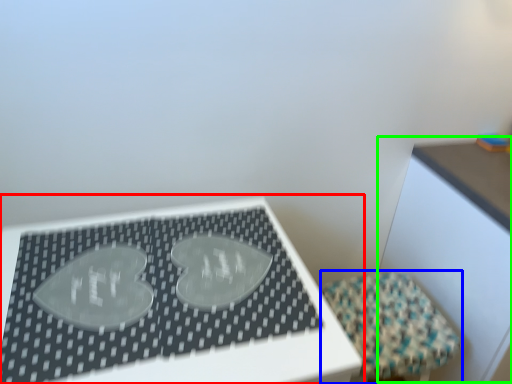
Question: Considering the real-world distances, which object is farthest from table (highlighted by a red box)? furniture (highlighted by a blue box) or table (highlighted by a green box)?

Choices:
 (A) furniture
 (B) table

Answer: (B)